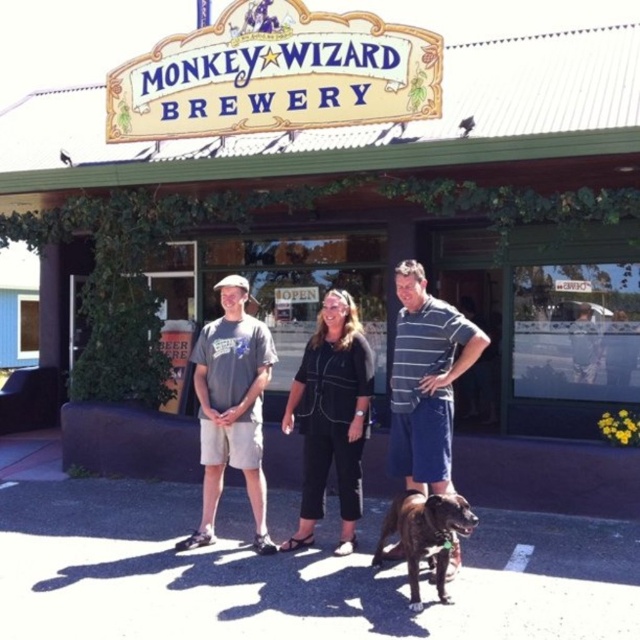
You are a fashion designer observing the scene at Monkey Wizard Brewery. You notice the black cotton pants at center and the striped cotton shirt at center. Which clothing item is taller?

The black cotton pants at center is taller than the striped cotton shirt at center.